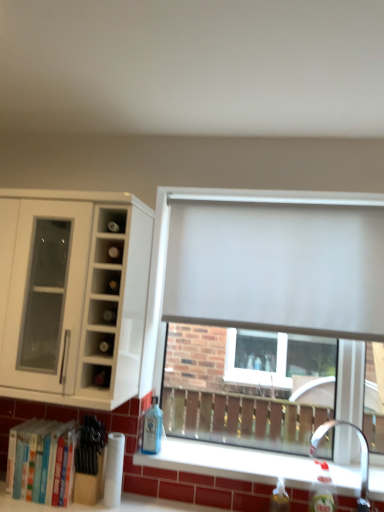
What do you see at coordinates (257, 256) in the screenshot? I see `white matte window at center` at bounding box center [257, 256].

This screenshot has height=512, width=384. Find the location of `white glossy window sill at lower center`. white glossy window sill at lower center is located at coordinates (229, 462).

You are a GUI agent. You are given a task and a screenshot of the screen. Output one action in this format:
    pyautogui.click(x=<x>, y=<y>)
    Task: Click on the translucent plastic bottle at lower right, positioned as the 3th bottle in back-to-front order
    The image size is (384, 512).
    Given the screenshot: What is the action you would take?
    click(322, 490)

You are a GUI agent. You are given a task and a screenshot of the screen. Output one action in this format:
    pyautogui.click(x=<x>, y=<y>)
    Task: Click on the white matte curtain at center
    
    Given the screenshot: What is the action you would take?
    pyautogui.click(x=277, y=264)

I want to click on white matte window at center, so click(x=257, y=256).

In the image, there is a white matte cabinet at left. At what (x,y) coordinates should I click in order to perform the action: click on window below it (from the image's perspective). Please return your answer as a coordinate pair (x, y). Looking at the image, I should click on (257, 256).

From a real-world perspective, does white matte window at center stand above white matte cabinet at left?

No, from a real-world perspective, white matte window at center is not above white matte cabinet at left.

Is white matte window at center to the right of white matte cabinet at left from the viewer's perspective?

Yes, white matte window at center is to the right of white matte cabinet at left.

Is white matte window at center oriented away from white matte cabinet at left?

white matte window at center is not turned away from white matte cabinet at left.

How distant is translucent plastic bottle at lower right, which is the 2th bottle in front-to-back order, from white matte curtain at center?

A distance of 35.45 inches exists between translucent plastic bottle at lower right, which is the 2th bottle in front-to-back order, and white matte curtain at center.

Does point (271, 498) lie in front of point (259, 224)?

Yes, point (271, 498) is in front of point (259, 224).

Is translucent plastic bottle at lower right, which is the 2th bottle in front-to-back order, oriented away from white matte curtain at center?

No.

Is white matte curtain at center a part of translucent plastic bottle at lower right, marked as the 2th bottle in a left-to-right arrangement?

No, white matte curtain at center is located outside of translucent plastic bottle at lower right, marked as the 2th bottle in a left-to-right arrangement.

Could white matte curtain at center be considered to be inside matte white wine rack at upper left?

Actually, white matte curtain at center is outside matte white wine rack at upper left.

Can you confirm if matte white wine rack at upper left is wider than white matte curtain at center?

Correct, the width of matte white wine rack at upper left exceeds that of white matte curtain at center.

Where is `cabinetry above the translucent plastic bottle at lower right, positioned as the second bottle in back-to-front order (from the image's perspective)`? cabinetry above the translucent plastic bottle at lower right, positioned as the second bottle in back-to-front order (from the image's perspective) is located at coordinates (73, 295).

Does point (80, 238) come in front of point (281, 490)?

That is True.

Is white matte cabinet at left to the left of translucent plastic bottle at lower right, marked as the 2th bottle in a left-to-right arrangement, from the viewer's perspective?

Yes, white matte cabinet at left is to the left of translucent plastic bottle at lower right, marked as the 2th bottle in a left-to-right arrangement.

Considering the relative sizes of white matte cabinet at left and translucent plastic bottle at lower right, positioned as the second bottle in back-to-front order, in the image provided, is white matte cabinet at left wider than translucent plastic bottle at lower right, positioned as the second bottle in back-to-front order,?

Correct, the width of white matte cabinet at left exceeds that of translucent plastic bottle at lower right, positioned as the second bottle in back-to-front order.

Looking at the image, does translucent plastic bottle at lower right, the 1th bottle viewed from the front, seem bigger or smaller compared to white matte cabinet at left?

In the image, translucent plastic bottle at lower right, the 1th bottle viewed from the front, appears to be smaller than white matte cabinet at left.

I want to click on cabinetry that is on the left side of translucent plastic bottle at lower right, which appears as the first bottle when viewed from the right, so click(x=73, y=295).

Is there a large distance between translucent plastic bottle at lower right, the third bottle positioned from the left, and white matte cabinet at left?

translucent plastic bottle at lower right, the third bottle positioned from the left, is far away from white matte cabinet at left.

From a real-world perspective, is translucent plastic bottle at lower right, positioned as the 3th bottle in back-to-front order, positioned above or below white matte cabinet at left?

Clearly, from a real-world perspective, translucent plastic bottle at lower right, positioned as the 3th bottle in back-to-front order, is below white matte cabinet at left.

Find the location of a particular element. bookshelf located below the white matte curtain at center (from the image's perspective) is located at coordinates (37, 459).

From the image's perspective, is white matte curtain at center on top of hardcover books at lower left?

Indeed, from the image's perspective, white matte curtain at center is shown above hardcover books at lower left.

Are white matte curtain at center and hardcover books at lower left beside each other?

No, white matte curtain at center is not in contact with hardcover books at lower left.

Which object is further away from the camera, white matte curtain at center or hardcover books at lower left?

white matte curtain at center is further from the camera.

Is white matte window at center next to white matte curtain at center and touching it?

Yes, white matte window at center is beside white matte curtain at center.

Which is in front, point (179, 317) or point (194, 229)?

Point (179, 317)

From the image's perspective, is white matte window at center under white matte curtain at center?

Yes.

You are a GUI agent. You are given a task and a screenshot of the screen. Output one action in this format:
    pyautogui.click(x=<x>, y=<y>)
    Task: Click on the cabinetry located on the left of white matte window at center
    The height and width of the screenshot is (512, 384).
    Given the screenshot: What is the action you would take?
    (x=73, y=295)

Identify the location of the 1st bottle in front of the white matte curtain at center, starting your count from the anchor. (279, 498).

Based on their spatial positions, is white matte window at center or white glossy window sill at lower center closer to matte white wine rack at upper left?

white matte window at center is positioned closer to the anchor matte white wine rack at upper left.

Based on their spatial positions, is white matte curtain at center or blue glass bottle at lower center, the first bottle viewed from the back, closer to translucent plastic bottle at lower right, positioned as the second bottle in back-to-front order?

The object closer to translucent plastic bottle at lower right, positioned as the second bottle in back-to-front order, is blue glass bottle at lower center, the first bottle viewed from the back.

From the image, which object appears to be nearer to white glossy window sill at lower center, white matte cabinet at left or white matte curtain at center?

Among the two, white matte cabinet at left is located nearer to white glossy window sill at lower center.

Looking at the image, which one is located closer to matte white wine rack at upper left, translucent plastic bottle at lower right, which appears as the first bottle when viewed from the right, or blue glass bottle at lower center, the first bottle viewed from the back?

Based on the image, blue glass bottle at lower center, the first bottle viewed from the back, appears to be nearer to matte white wine rack at upper left.

Looking at the image, which one is located further to satin nickel faucet at lower right, translucent plastic bottle at lower right, the 1th bottle viewed from the front, or white glossy window sill at lower center?

Based on the image, white glossy window sill at lower center appears to be further to satin nickel faucet at lower right.

From the image, which object appears to be nearer to satin nickel faucet at lower right, hardcover books at lower left or white matte cabinet at left?

hardcover books at lower left is positioned closer to the anchor satin nickel faucet at lower right.

Looking at the image, which one is located closer to white matte window at center, satin nickel faucet at lower right or white glossy window sill at lower center?

white glossy window sill at lower center.

From the picture: Looking at the image, which one is located closer to hardcover books at lower left, translucent plastic bottle at lower right, marked as the 2th bottle in a left-to-right arrangement, or white matte window at center?

white matte window at center.

You are a GUI agent. You are given a task and a screenshot of the screen. Output one action in this format:
    pyautogui.click(x=<x>, y=<y>)
    Task: Click on the window sill between white matte curtain at center and translucent plastic bottle at lower right, positioned as the second bottle in back-to-front order, vertically
    The height and width of the screenshot is (512, 384).
    Given the screenshot: What is the action you would take?
    pyautogui.click(x=229, y=462)

I want to click on curtain between matte white wine rack at upper left and satin nickel faucet at lower right from left to right, so click(277, 264).

This screenshot has height=512, width=384. What are the coordinates of `window sill between white matte cabinet at left and translucent plastic bottle at lower right, which appears as the first bottle when viewed from the right, in the horizontal direction` in the screenshot? It's located at (229, 462).

Where is `faucet between white matte window at center and translucent plastic bottle at lower right, which is the 2th bottle in front-to-back order, in the up-down direction`? The image size is (384, 512). faucet between white matte window at center and translucent plastic bottle at lower right, which is the 2th bottle in front-to-back order, in the up-down direction is located at coordinates (360, 451).